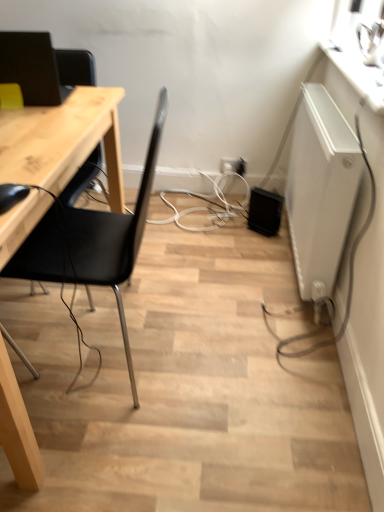
Identify the location of white plastic electric outlet at center, acting as the 1th electric outlet starting from the right. The image size is (384, 512). (241, 167).

Locate an element on the screen. The height and width of the screenshot is (512, 384). white matte radiator at right is located at coordinates (320, 188).

In order to face black matte chair at left, should I rotate leftwards or rightwards?

Turn left by 13.730 degrees to look at black matte chair at left.

You are a GUI agent. You are given a task and a screenshot of the screen. Output one action in this format:
    pyautogui.click(x=<x>, y=<y>)
    Task: Click on the white plastic electric outlet at center, marked as the second electric outlet in a left-to-right arrangement
    This screenshot has width=384, height=512.
    Given the screenshot: What is the action you would take?
    pyautogui.click(x=241, y=167)

Between black matte chair at left and white matte radiator at right, which one is positioned behind?

white matte radiator at right is further away from the camera.

What's the angular difference between black matte chair at left and white matte radiator at right's facing directions?

They differ by 1.39 degrees in their facing directions.

Does point (51, 260) lie behind point (297, 182)?

No.

Can we say white matte radiator at right lies outside matte black monitor at upper left?

Indeed, white matte radiator at right is completely outside matte black monitor at upper left.

Looking at their sizes, would you say white matte radiator at right is wider or thinner than matte black monitor at upper left?

Clearly, white matte radiator at right has less width compared to matte black monitor at upper left.

Based on the photo, considering the sizes of white matte radiator at right and matte black monitor at upper left in the image, is white matte radiator at right bigger or smaller than matte black monitor at upper left?

Considering their sizes, white matte radiator at right takes up more space than matte black monitor at upper left.

From a real-world perspective, is white matte radiator at right over matte black monitor at upper left?

Actually, white matte radiator at right is physically below matte black monitor at upper left in the real world.

Can you confirm if white plastic electric outlet at center, the 2th electric outlet from the right, is wider than black matte chair at left?

No.

In the scene shown: From a real-world perspective, is white plastic electric outlet at center, which is the first electric outlet in left-to-right order, physically located above or below black matte chair at left?

In terms of real-world spatial position, white plastic electric outlet at center, which is the first electric outlet in left-to-right order, is below black matte chair at left.

Is white plastic electric outlet at center, which is the first electric outlet in left-to-right order, looking in the opposite direction of black matte chair at left?

That's not correct — white plastic electric outlet at center, which is the first electric outlet in left-to-right order, is not looking away from black matte chair at left.

Does white plastic electric outlet at center, the 2th electric outlet from the right, have a larger size compared to black matte chair at left?

No.

From a real-world perspective, between white plastic electric outlet at center, the 2th electric outlet from the right, and white plastic electric outlet at center, acting as the 1th electric outlet starting from the right, who is vertically lower?

In real-world perspective, white plastic electric outlet at center, acting as the 1th electric outlet starting from the right, is lower.

Is white plastic electric outlet at center, which is the first electric outlet in left-to-right order, at the left side of white plastic electric outlet at center, acting as the 1th electric outlet starting from the right?

Correct, you'll find white plastic electric outlet at center, which is the first electric outlet in left-to-right order, to the left of white plastic electric outlet at center, acting as the 1th electric outlet starting from the right.

Can you tell me how much white plastic electric outlet at center, the 2th electric outlet from the right, and white plastic electric outlet at center, acting as the 1th electric outlet starting from the right, differ in facing direction?

There is a 0.00265-degree angle between the facing directions of white plastic electric outlet at center, the 2th electric outlet from the right, and white plastic electric outlet at center, acting as the 1th electric outlet starting from the right.

Between white plastic electric outlet at center, the 2th electric outlet from the right, and white plastic electric outlet at center, acting as the 1th electric outlet starting from the right, which one has smaller width?

white plastic electric outlet at center, acting as the 1th electric outlet starting from the right.

How far apart are black matte chair at left and white glossy counter top at upper right?

black matte chair at left and white glossy counter top at upper right are 34.72 inches apart from each other.

Which of these two, black matte chair at left or white glossy counter top at upper right, stands shorter?

Standing shorter between the two is white glossy counter top at upper right.

Does black matte chair at left have a smaller size compared to white glossy counter top at upper right?

Actually, black matte chair at left might be larger than white glossy counter top at upper right.

Looking at their sizes, would you say black matte chair at left is wider or thinner than white glossy counter top at upper right?

Clearly, black matte chair at left has more width compared to white glossy counter top at upper right.

Is black matte chair at left oriented towards white plastic electric outlet at center, the 2th electric outlet from the right?

No, black matte chair at left is not turned towards white plastic electric outlet at center, the 2th electric outlet from the right.

Are black matte chair at left and white plastic electric outlet at center, which is the first electric outlet in left-to-right order, beside each other?

No, black matte chair at left is not in contact with white plastic electric outlet at center, which is the first electric outlet in left-to-right order.

Between point (146, 213) and point (243, 168), which one is positioned in front?

The point (146, 213) is more forward.

From the image's perspective, is black matte chair at left on matte black monitor at upper left?

No, from the image's perspective, black matte chair at left is not above matte black monitor at upper left.

Looking at this image, from their relative heights in the image, would you say black matte chair at left is taller or shorter than matte black monitor at upper left?

black matte chair at left is taller than matte black monitor at upper left.

From a real-world perspective, is black matte chair at left on top of matte black monitor at upper left?

No, from a real-world perspective, black matte chair at left is not on top of matte black monitor at upper left.

Where is `appliance located behind the black matte chair at left`? The image size is (384, 512). appliance located behind the black matte chair at left is located at coordinates (320, 188).

Where is `appliance lying on the right of matte black monitor at upper left`? appliance lying on the right of matte black monitor at upper left is located at coordinates (320, 188).

From the image, which object appears to be nearer to white matte radiator at right, black matte chair at left or white plastic electric outlet at center, the 2th electric outlet from the right?

black matte chair at left is closer to white matte radiator at right.

Consider the image. Looking at the image, which one is located further to matte black monitor at upper left, white plastic electric outlet at center, the 2th electric outlet from the right, or white matte radiator at right?

white plastic electric outlet at center, the 2th electric outlet from the right, is positioned further to the anchor matte black monitor at upper left.

Which object lies further to the anchor point white plastic electric outlet at center, the 2th electric outlet from the right, white plastic electric outlet at center, marked as the second electric outlet in a left-to-right arrangement, or white glossy counter top at upper right?

white glossy counter top at upper right lies further to white plastic electric outlet at center, the 2th electric outlet from the right, than the other object.

Looking at the image, which one is located closer to white matte radiator at right, white glossy counter top at upper right or white plastic electric outlet at center, acting as the 1th electric outlet starting from the right?

white glossy counter top at upper right is positioned closer to the anchor white matte radiator at right.

Based on their spatial positions, is white plastic electric outlet at center, which is the first electric outlet in left-to-right order, or matte black monitor at upper left further from black matte chair at left?

Among the two, white plastic electric outlet at center, which is the first electric outlet in left-to-right order, is located further to black matte chair at left.

Looking at the image, which one is located closer to matte black monitor at upper left, white plastic electric outlet at center, acting as the 1th electric outlet starting from the right, or white plastic electric outlet at center, which is the first electric outlet in left-to-right order?

The object closer to matte black monitor at upper left is white plastic electric outlet at center, which is the first electric outlet in left-to-right order.

Estimate the real-world distances between objects in this image. Which object is further from white plastic electric outlet at center, which is the first electric outlet in left-to-right order, matte black monitor at upper left or black matte chair at left?

black matte chair at left is positioned further to the anchor white plastic electric outlet at center, which is the first electric outlet in left-to-right order.

When comparing their distances from white plastic electric outlet at center, marked as the second electric outlet in a left-to-right arrangement, does white glossy counter top at upper right or white plastic electric outlet at center, which is the first electric outlet in left-to-right order, seem further?

white glossy counter top at upper right.

This screenshot has width=384, height=512. In order to click on electric outlet located between matte black monitor at upper left and white plastic electric outlet at center, which is the first electric outlet in left-to-right order, in the depth direction in this screenshot , I will do `click(241, 167)`.

The image size is (384, 512). What are the coordinates of `computer monitor positioned between black matte chair at left and white plastic electric outlet at center, the 2th electric outlet from the right, from near to far` in the screenshot? It's located at (31, 67).

Locate an element on the screen. This screenshot has width=384, height=512. appliance located between white glossy counter top at upper right and white plastic electric outlet at center, acting as the 1th electric outlet starting from the right, in the depth direction is located at coordinates (320, 188).

The height and width of the screenshot is (512, 384). I want to click on appliance between black matte chair at left and white glossy counter top at upper right from left to right, so coord(320,188).